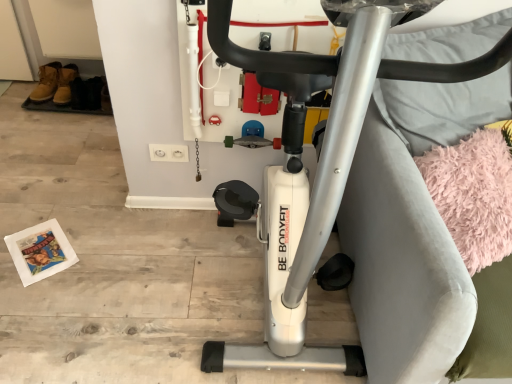
Describe the element at coordinates (474, 194) in the screenshot. I see `pink fluffy yoga mat at right` at that location.

Find the location of `pink fluffy yoga mat at right`. pink fluffy yoga mat at right is located at coordinates (474, 194).

Locate an element on the screen. The width and height of the screenshot is (512, 384). silver metallic stationary bicycle at center is located at coordinates (343, 104).

Describe the element at coordinates (343, 104) in the screenshot. I see `silver metallic stationary bicycle at center` at that location.

Image resolution: width=512 pixels, height=384 pixels. In order to click on pink fluffy yoga mat at right in this screenshot , I will do `click(474, 194)`.

Can you confirm if silver metallic stationary bicycle at center is positioned to the right of pink fluffy yoga mat at right?

Incorrect, silver metallic stationary bicycle at center is not on the right side of pink fluffy yoga mat at right.

Based on the photo, which object is closer to the camera taking this photo, silver metallic stationary bicycle at center or pink fluffy yoga mat at right?

silver metallic stationary bicycle at center is in front.

Is point (389, 314) positioned in front of point (492, 197)?

Yes, point (389, 314) is closer to viewer.

From the image's perspective, which is above, silver metallic stationary bicycle at center or pink fluffy yoga mat at right?

silver metallic stationary bicycle at center appears higher in the image.

From a real-world perspective, is silver metallic stationary bicycle at center beneath pink fluffy yoga mat at right?

No, from a real-world perspective, silver metallic stationary bicycle at center is not under pink fluffy yoga mat at right.

Is silver metallic stationary bicycle at center wider or thinner than pink fluffy yoga mat at right?

Considering their sizes, silver metallic stationary bicycle at center looks broader than pink fluffy yoga mat at right.

From their relative heights in the image, would you say silver metallic stationary bicycle at center is taller or shorter than pink fluffy yoga mat at right?

In the image, silver metallic stationary bicycle at center appears to be taller than pink fluffy yoga mat at right.

Between silver metallic stationary bicycle at center and pink fluffy yoga mat at right, which one has larger size?

With larger size is silver metallic stationary bicycle at center.

Is pink fluffy yoga mat at right surrounded by silver metallic stationary bicycle at center?

That's incorrect, pink fluffy yoga mat at right is not inside silver metallic stationary bicycle at center.

Is there a large distance between silver metallic stationary bicycle at center and pink fluffy yoga mat at right?

Actually, silver metallic stationary bicycle at center and pink fluffy yoga mat at right are a little close together.

Could you tell me if silver metallic stationary bicycle at center is turned towards pink fluffy yoga mat at right?

No, silver metallic stationary bicycle at center is not aimed at pink fluffy yoga mat at right.

Find the location of a particular element. The height and width of the screenshot is (384, 512). stationary bicycle that appears in front of the pink fluffy yoga mat at right is located at coordinates (343, 104).

Is pink fluffy yoga mat at right at the left side of silver metallic stationary bicycle at center?

No.

Considering the positions of objects pink fluffy yoga mat at right and silver metallic stationary bicycle at center in the image provided, who is behind, pink fluffy yoga mat at right or silver metallic stationary bicycle at center?

pink fluffy yoga mat at right is further from the camera.

Is point (474, 245) positioned before point (438, 72)?

No, (474, 245) is behind (438, 72).

From the image's perspective, is pink fluffy yoga mat at right above or below silver metallic stationary bicycle at center?

pink fluffy yoga mat at right is below silver metallic stationary bicycle at center.

From a real-world perspective, is pink fluffy yoga mat at right above or below silver metallic stationary bicycle at center?

Clearly, from a real-world perspective, pink fluffy yoga mat at right is below silver metallic stationary bicycle at center.

In the scene shown: Does pink fluffy yoga mat at right have a lesser width compared to silver metallic stationary bicycle at center?

Yes, pink fluffy yoga mat at right is thinner than silver metallic stationary bicycle at center.

Considering the sizes of pink fluffy yoga mat at right and silver metallic stationary bicycle at center in the image, is pink fluffy yoga mat at right taller or shorter than silver metallic stationary bicycle at center?

Clearly, pink fluffy yoga mat at right is shorter compared to silver metallic stationary bicycle at center.

Can you confirm if pink fluffy yoga mat at right is smaller than silver metallic stationary bicycle at center?

Correct, pink fluffy yoga mat at right occupies less space than silver metallic stationary bicycle at center.

Is pink fluffy yoga mat at right surrounding silver metallic stationary bicycle at center?

Actually, silver metallic stationary bicycle at center is outside pink fluffy yoga mat at right.

Is pink fluffy yoga mat at right next to silver metallic stationary bicycle at center?

No, pink fluffy yoga mat at right is not in contact with silver metallic stationary bicycle at center.

Could you tell me if pink fluffy yoga mat at right is turned towards silver metallic stationary bicycle at center?

No, pink fluffy yoga mat at right is not facing towards silver metallic stationary bicycle at center.

In the scene shown: How many degrees apart are the facing directions of pink fluffy yoga mat at right and silver metallic stationary bicycle at center?

24 degrees.

Identify the location of yoga mat on the right of silver metallic stationary bicycle at center. (474, 194).

Locate an element on the screen. The width and height of the screenshot is (512, 384). stationary bicycle to the left of pink fluffy yoga mat at right is located at coordinates (343, 104).

The image size is (512, 384). Find the location of `stationary bicycle that is above the pink fluffy yoga mat at right (from a real-world perspective)`. stationary bicycle that is above the pink fluffy yoga mat at right (from a real-world perspective) is located at coordinates (343, 104).